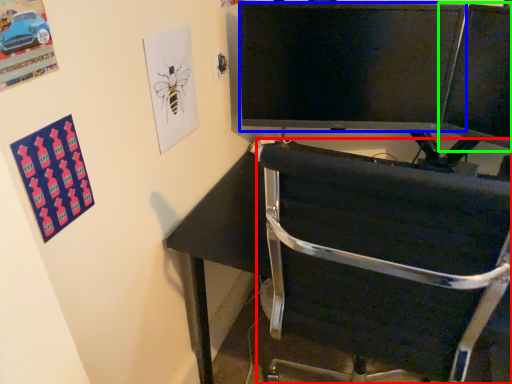
Question: Estimate the real-world distances between objects in this image. Which object is farther from chair (highlighted by a red box), television (highlighted by a blue box) or computer monitor (highlighted by a green box)?

Choices:
 (A) television
 (B) computer monitor

Answer: (B)